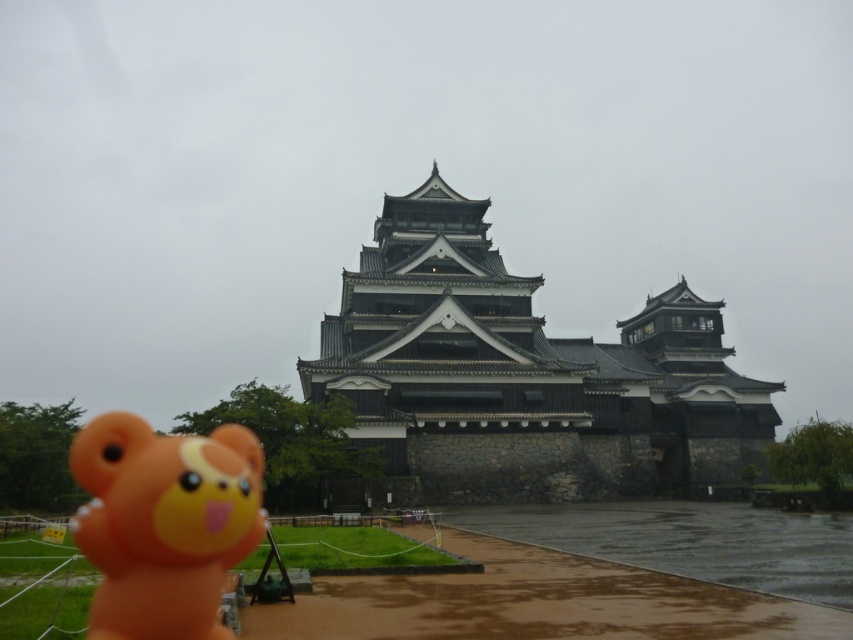
You are standing at the orange plush bear toy in the foreground of the Japanese castle scene. You want to walk towards the castle entrance. Which direction should you move relative to the two points labeled as point (456, 408) and point (169, 637)?

Since point (456, 408) is behind point (169, 637), you should move towards the direction of point (169, 637) to reach the castle entrance because it is closer to you, and the other point is further back towards the castle.